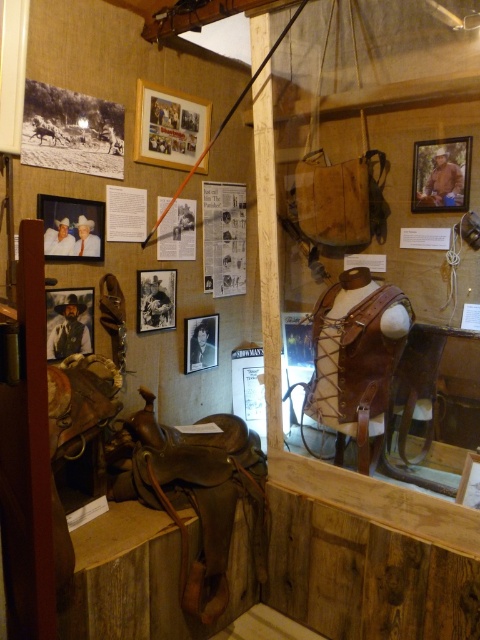
Measure the distance between wooden frame at upper center and camera.

A distance of 7.24 feet exists between wooden frame at upper center and camera.

Describe the element at coordinates (168, 128) in the screenshot. This screenshot has height=640, width=480. I see `wooden frame at upper center` at that location.

Between point (169, 120) and point (477, 504), which one is positioned in front?

Positioned in front is point (477, 504).

Where is `wooden frame at upper center`? wooden frame at upper center is located at coordinates (168, 128).

Does point (72, 304) come closer to viewer compared to point (170, 301)?

Yes, point (72, 304) is in front of point (170, 301).

Who is taller, matte black picture frame at left or black matte photo frame at center?

Standing taller between the two is matte black picture frame at left.

Who is more forward, (x=70, y=317) or (x=158, y=321)?

Point (x=70, y=317) is in front.

Identify the location of matte black picture frame at left. (69, 321).

Does matte wooden picture frame at upper left appear over matte black picture frame at left?

Indeed, matte wooden picture frame at upper left is positioned over matte black picture frame at left.

Between matte wooden picture frame at upper left and matte black picture frame at left, which one is positioned higher?

matte wooden picture frame at upper left is higher up.

Is point (61, 248) positioned before point (58, 308)?

Yes, point (61, 248) is closer to viewer.

This screenshot has width=480, height=640. Identify the location of matte wooden picture frame at upper left. (72, 227).